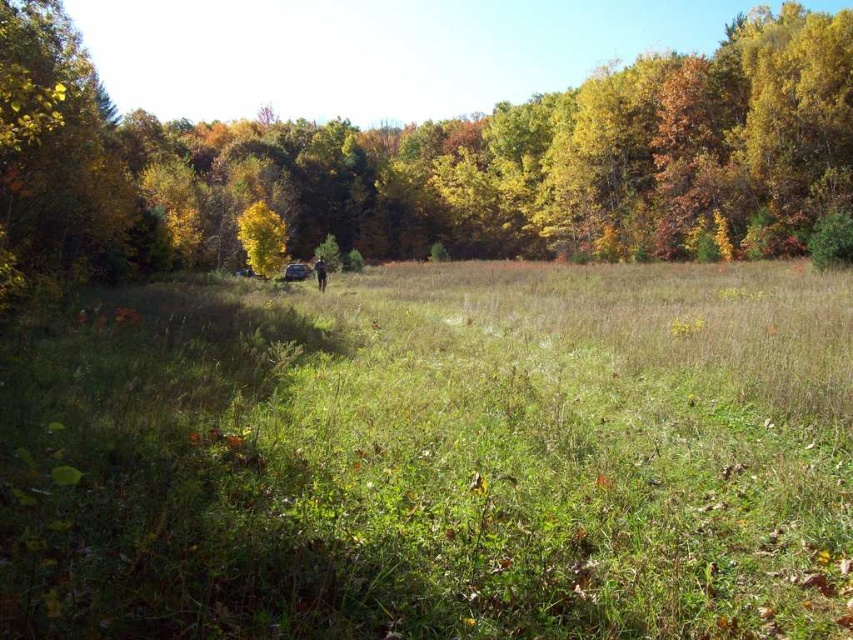
Question: Which of the following is the closest to the observer?

Choices:
 (A) green grassy field at center
 (B) green leafy tree at center
 (C) yellow leafy tree at center

Answer: (A)

Question: Can you confirm if green grassy field at center is positioned to the right of yellow leafy tree at center?

Choices:
 (A) no
 (B) yes

Answer: (B)

Question: Is green leafy tree at center to the right of yellow leafy tree at center from the viewer's perspective?

Choices:
 (A) no
 (B) yes

Answer: (B)

Question: Which point is closer to the camera?

Choices:
 (A) (265, 275)
 (B) (364, 451)

Answer: (B)

Question: Which point is farther from the camera taking this photo?

Choices:
 (A) (846, 68)
 (B) (251, 259)

Answer: (A)

Question: Is the position of green grassy field at center more distant than that of green leafy tree at center?

Choices:
 (A) yes
 (B) no

Answer: (B)